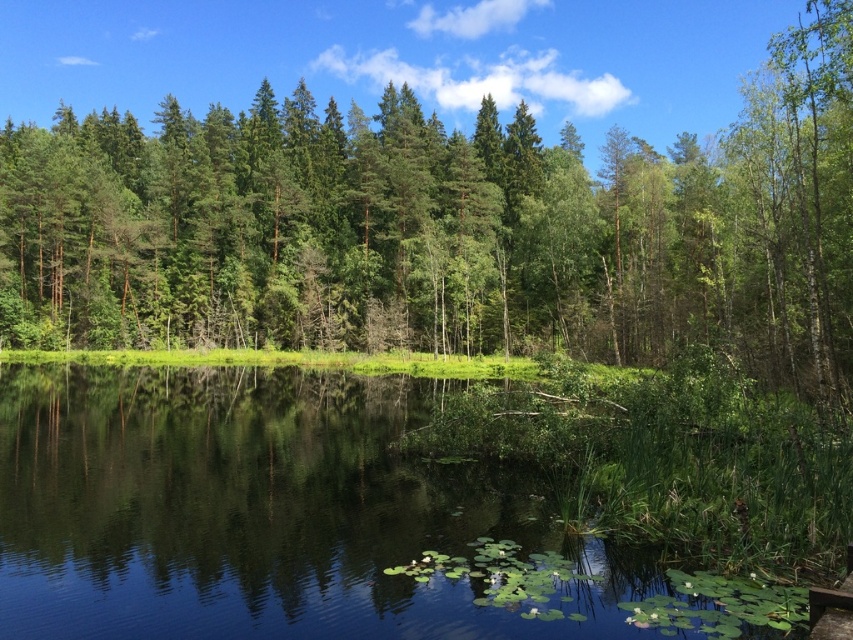
Does green leafy tree at center have a greater width compared to green leafy vegetation at lower center?

Yes, green leafy tree at center is wider than green leafy vegetation at lower center.

Does green leafy tree at center have a greater height compared to green leafy vegetation at lower center?

Yes, green leafy tree at center is taller than green leafy vegetation at lower center.

Describe the element at coordinates (445, 228) in the screenshot. I see `green leafy tree at center` at that location.

Identify the location of green leafy tree at center. This screenshot has width=853, height=640. (445, 228).